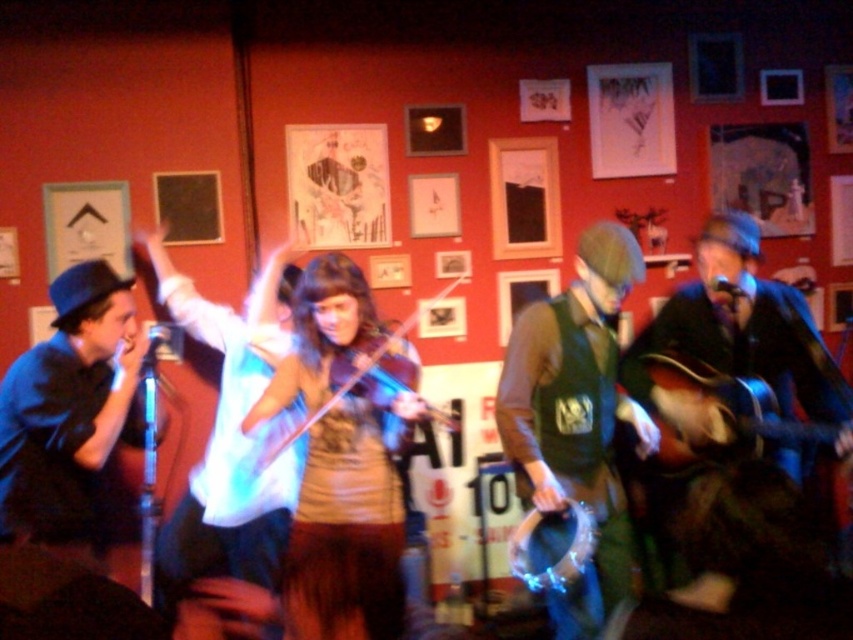
Between shiny gold dress at center and wooden acoustic guitar at right, which one appears on the right side from the viewer's perspective?

Positioned to the right is wooden acoustic guitar at right.

Who is higher up, shiny gold dress at center or wooden acoustic guitar at right?

wooden acoustic guitar at right is above.

Measure the distance between point [398,435] and camera.

Point [398,435] is 8.20 feet from camera.

Find the location of a particular element. The width and height of the screenshot is (853, 640). shiny gold dress at center is located at coordinates (349, 525).

Which is above, shiny gold dress at center or shiny brown violin at center?

shiny brown violin at center is above.

Who is more distant from viewer, (360, 593) or (321, 413)?

The point (360, 593) is more distant.

The image size is (853, 640). What are the coordinates of `shiny gold dress at center` in the screenshot? It's located at (349, 525).

Can you confirm if wooden acoustic guitar at center is bigger than wooden acoustic guitar at right?

Yes.

Does wooden acoustic guitar at center lie in front of wooden acoustic guitar at right?

Yes, it is.

Is point (692, 401) less distant than point (695, 449)?

No, it is behind (695, 449).

Locate an element on the screen. Image resolution: width=853 pixels, height=640 pixels. wooden acoustic guitar at center is located at coordinates (606, 268).